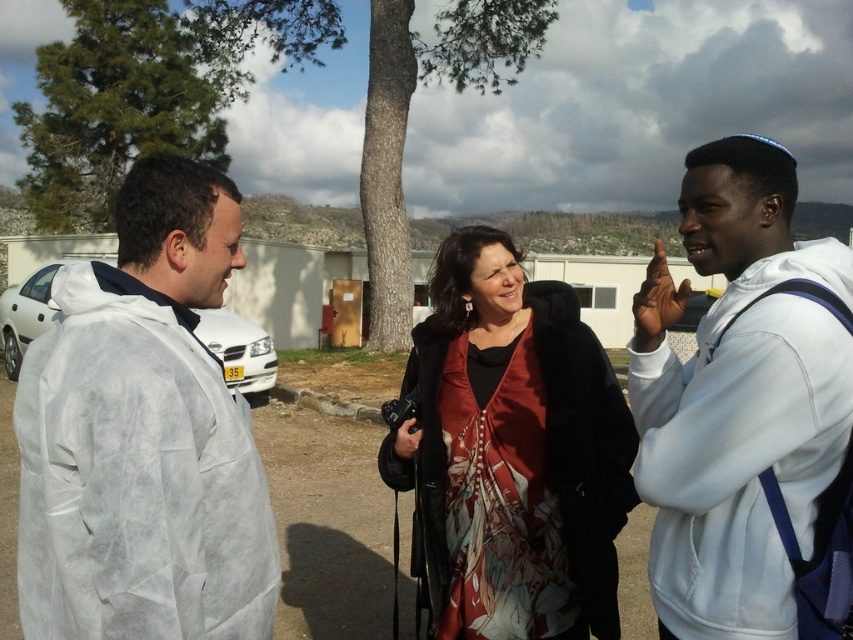
Question: Can you confirm if white paper coat at left is thinner than white fleece jacket at right?

Choices:
 (A) yes
 (B) no

Answer: (B)

Question: Is white paper coat at left to the left of white matte car at left from the viewer's perspective?

Choices:
 (A) no
 (B) yes

Answer: (A)

Question: Which of the following is the closest to the observer?

Choices:
 (A) (265, 365)
 (B) (508, 237)
 (C) (648, 502)
 (D) (177, 625)

Answer: (D)

Question: Which is farther from the white fleece jacket at right?

Choices:
 (A) satin dress at center
 (B) white matte car at left

Answer: (B)

Question: Is satin dress at center smaller than white matte car at left?

Choices:
 (A) yes
 (B) no

Answer: (A)

Question: Among these objects, which one is nearest to the camera?

Choices:
 (A) white matte car at left
 (B) white fleece jacket at right
 (C) satin dress at center

Answer: (B)